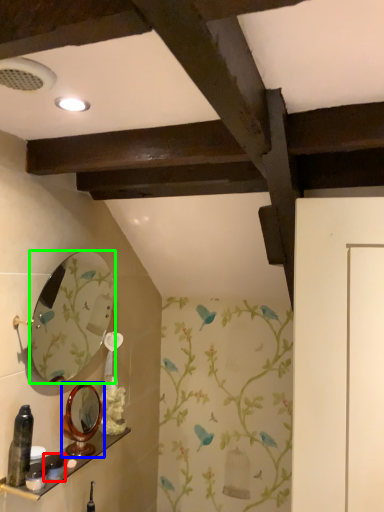
Question: Estimate the real-world distances between objects in this image. Which object is closer to toiletry (highlighted by a red box), mirror (highlighted by a blue box) or mirror (highlighted by a green box)?

Choices:
 (A) mirror
 (B) mirror

Answer: (A)